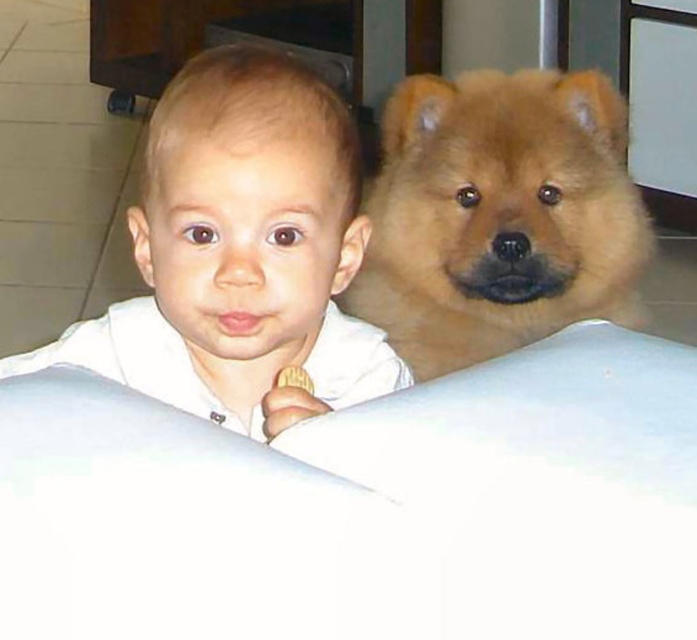
Is smooth white shirt at upper left taller than fluffy brown dog at upper right?

In fact, smooth white shirt at upper left may be shorter than fluffy brown dog at upper right.

Which is behind, point (252, 316) or point (451, 106)?

Point (451, 106)

At what (x,y) coordinates should I click in order to perform the action: click on smooth white shirt at upper left. Please return your answer as a coordinate pair (x, y). Image resolution: width=697 pixels, height=640 pixels. Looking at the image, I should click on (240, 253).